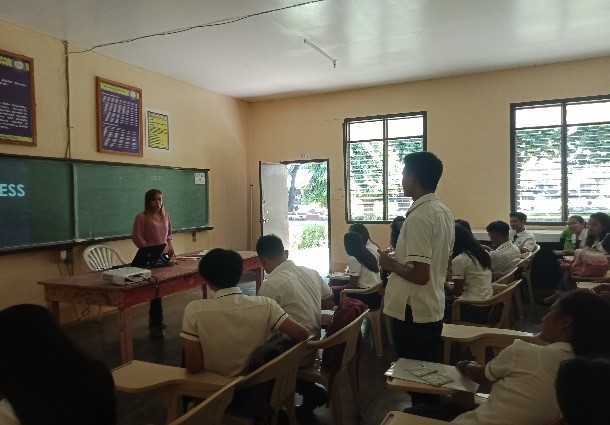
Locate an element on the screen. board is located at coordinates (203, 187).